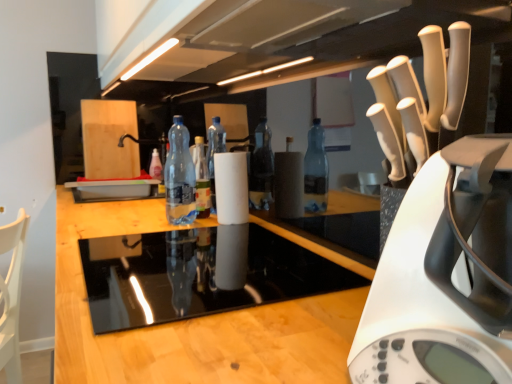
Question: From the image's perspective, is black glass stovetop at center beneath translucent plastic bottle at center, which ranks as the 2th bottle in front-to-back order?

Choices:
 (A) yes
 (B) no

Answer: (A)

Question: Considering the relative sizes of black glass stovetop at center and translucent plastic bottle at center, which ranks as the 2th bottle in front-to-back order, in the image provided, is black glass stovetop at center wider than translucent plastic bottle at center, which ranks as the 2th bottle in front-to-back order,?

Choices:
 (A) yes
 (B) no

Answer: (A)

Question: Is black glass stovetop at center in front of translucent plastic bottle at center, the second bottle when ordered from right to left?

Choices:
 (A) yes
 (B) no

Answer: (A)

Question: Considering the relative sizes of black glass stovetop at center and translucent plastic bottle at center, positioned as the first bottle in back-to-front order, in the image provided, is black glass stovetop at center thinner than translucent plastic bottle at center, positioned as the first bottle in back-to-front order,?

Choices:
 (A) no
 (B) yes

Answer: (A)

Question: Considering the relative sizes of black glass stovetop at center and translucent plastic bottle at center, the second bottle when ordered from right to left, in the image provided, is black glass stovetop at center taller than translucent plastic bottle at center, the second bottle when ordered from right to left,?

Choices:
 (A) yes
 (B) no

Answer: (B)

Question: Is black glass stovetop at center bigger or smaller than white plastic kettle at right?

Choices:
 (A) small
 (B) big

Answer: (B)

Question: Is black glass stovetop at center taller or shorter than white plastic kettle at right?

Choices:
 (A) tall
 (B) short

Answer: (B)

Question: Considering the positions of black glass stovetop at center and white plastic kettle at right in the image, is black glass stovetop at center wider or thinner than white plastic kettle at right?

Choices:
 (A) thin
 (B) wide

Answer: (B)

Question: From the image's perspective, is black glass stovetop at center positioned above or below white plastic kettle at right?

Choices:
 (A) below
 (B) above

Answer: (A)

Question: Is transparent plastic bottle at center, which is counted as the second bottle, starting from the back, taller or shorter than white plastic kettle at right?

Choices:
 (A) short
 (B) tall

Answer: (B)

Question: Is point (164, 178) positioned closer to the camera than point (487, 254)?

Choices:
 (A) closer
 (B) farther

Answer: (B)

Question: In terms of width, does transparent plastic bottle at center, the 1th bottle when ordered from front to back, look wider or thinner when compared to white plastic kettle at right?

Choices:
 (A) wide
 (B) thin

Answer: (B)

Question: Is transparent plastic bottle at center, which is the 1th bottle in right-to-left order, in front of or behind white plastic kettle at right in the image?

Choices:
 (A) behind
 (B) front

Answer: (A)

Question: In the image, is white plastic kettle at right positioned in front of or behind translucent plastic bottle at center, the first bottle viewed from the left?

Choices:
 (A) behind
 (B) front

Answer: (B)

Question: Is white plastic kettle at right wider or thinner than translucent plastic bottle at center, positioned as the first bottle in back-to-front order?

Choices:
 (A) wide
 (B) thin

Answer: (A)